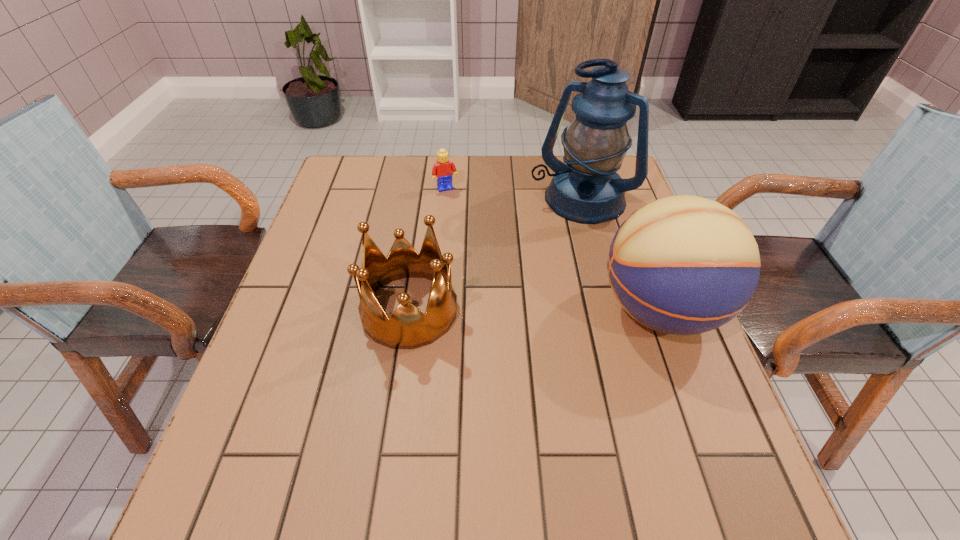
This screenshot has height=540, width=960. I want to click on vacant space at the near edge of the desktop, so click(518, 443).

In the image, there is a desktop. At what (x,y) coordinates should I click in order to perform the action: click on free space at the left edge. Please return your answer as a coordinate pair (x, y). The image size is (960, 540). Looking at the image, I should click on (315, 327).

Locate an element on the screen. The height and width of the screenshot is (540, 960). vacant space at the right edge of the desktop is located at coordinates (636, 209).

Image resolution: width=960 pixels, height=540 pixels. I want to click on free space between the shortest object and the tallest object, so click(x=513, y=194).

The height and width of the screenshot is (540, 960). Identify the location of empty location between the tallest object and the Lego. (513, 194).

The width and height of the screenshot is (960, 540). In order to click on free area in between the shortest object and the basketball in this screenshot , I will do `click(553, 249)`.

At what (x,y) coordinates should I click in order to perform the action: click on free space between the lantern and the Lego. Please return your answer as a coordinate pair (x, y). Looking at the image, I should click on (513, 194).

Identify which object is the second nearest to the lantern. Please provide its 2D coordinates. Your answer should be formatted as a tuple, i.e. [(x, y)], where the tuple contains the x and y coordinates of a point satisfying the conditions above.

[(443, 169)]

The width and height of the screenshot is (960, 540). What are the coordinates of `the second closest object to the third tallest object` in the screenshot? It's located at (684, 265).

You are a GUI agent. You are given a task and a screenshot of the screen. Output one action in this format:
    pyautogui.click(x=<x>, y=<y>)
    Task: Click on the free point that satisfies the following two spatial constraints: 1. on the front side of the second tallest object; 2. on the patterned surface of the Lego
    
    Given the screenshot: What is the action you would take?
    pyautogui.click(x=435, y=310)